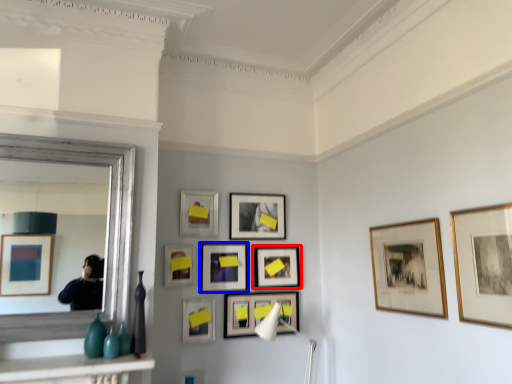
Question: Which point is closer to the camera, picture frame (highlighted by a red box) or picture frame (highlighted by a blue box)?

Choices:
 (A) picture frame
 (B) picture frame

Answer: (B)